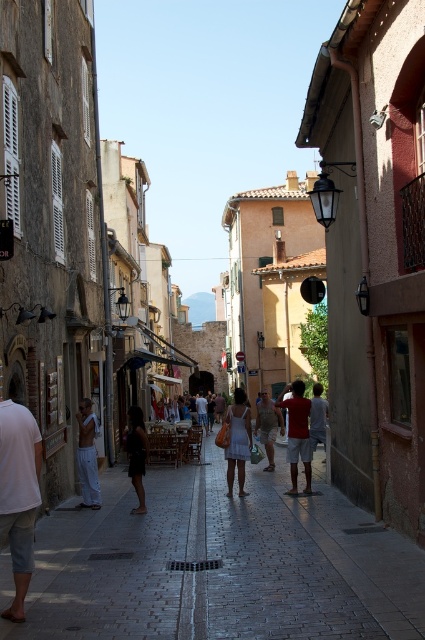
Question: Is dark gray dress at center in front of khaki cotton shorts at center?

Choices:
 (A) no
 (B) yes

Answer: (B)

Question: Which of the following is the farthest from the observer?

Choices:
 (A) khaki cotton shorts at center
 (B) dark gray dress at center
 (C) brick paved street at center

Answer: (A)

Question: Is brick paved street at center closer to the viewer compared to white dress at center?

Choices:
 (A) no
 (B) yes

Answer: (B)

Question: Considering the real-world distances, which object is closest to the matte red t-shirt at center?

Choices:
 (A) khaki cotton shorts at center
 (B) white dress at center

Answer: (B)

Question: Is white cotton pants at left closer to the viewer compared to dark gray dress at center?

Choices:
 (A) yes
 (B) no

Answer: (B)

Question: Among these objects, which one is farthest from the camera?

Choices:
 (A) khaki cotton shorts at center
 (B) white dress at center
 (C) light brown leather pants at center
 (D) white cotton pants at left

Answer: (A)